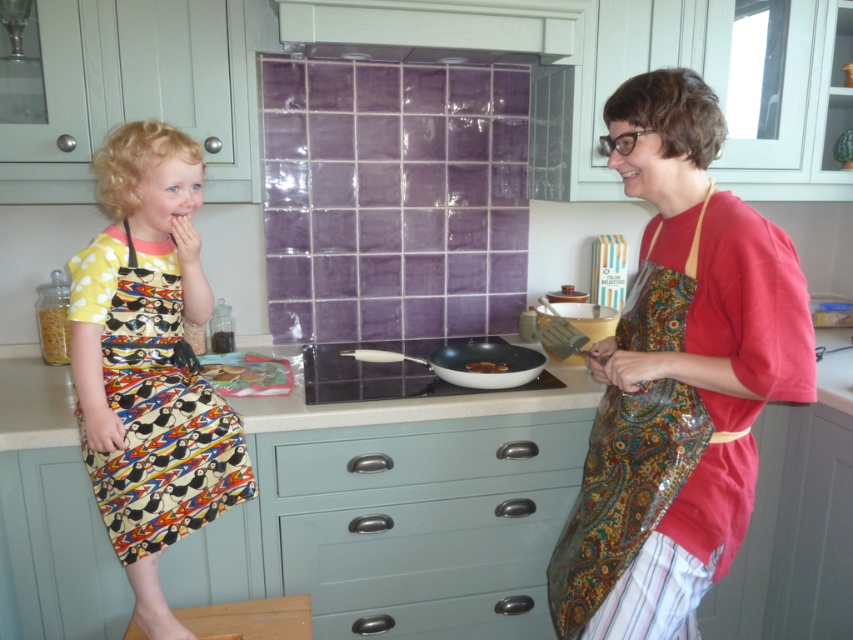
Question: Can you confirm if printed fabric dress at left is smaller than light blue wood drawer at center?

Choices:
 (A) yes
 (B) no

Answer: (B)

Question: Which point is farther from the camera taking this photo?

Choices:
 (A) tap(117, 314)
 (B) tap(345, 564)
 (C) tap(490, 364)
 (D) tap(442, 452)

Answer: (C)

Question: Is paisley-patterned fabric apron at right below smooth white countertop at center?

Choices:
 (A) no
 (B) yes

Answer: (B)

Question: Is matte red apron at right closer to the viewer compared to paisley-patterned fabric apron at right?

Choices:
 (A) no
 (B) yes

Answer: (B)

Question: Which of the following is the farthest from the observer?

Choices:
 (A) (517, 611)
 (B) (115, 291)

Answer: (A)

Question: Which object is farther from the camera taking this photo?

Choices:
 (A) light blue wood drawer at center
 (B) matte blue drawer at lower center
 (C) matte red apron at right

Answer: (B)